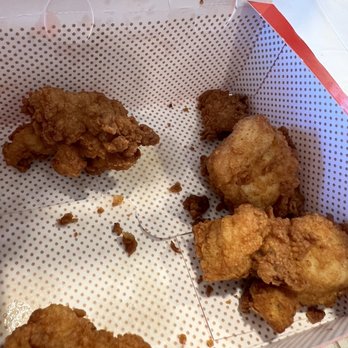
You are a GUI agent. You are given a task and a screenshot of the screen. Output one action in this format:
    pyautogui.click(x=<x>, y=<y>)
    Task: Click on the table
    The width and height of the screenshot is (348, 348).
    Given the screenshot: What is the action you would take?
    pyautogui.click(x=334, y=343)